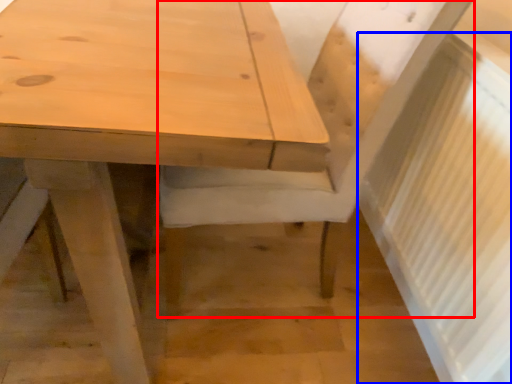
Question: Which object is closer to the camera taking this photo, chair (highlighted by a red box) or radiator (highlighted by a blue box)?

Choices:
 (A) chair
 (B) radiator

Answer: (B)